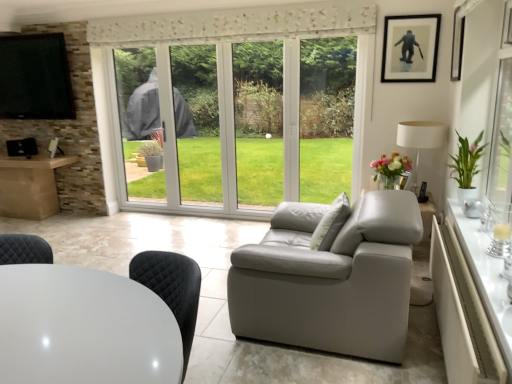
Question: Is black glossy picture frame at upper right, which appears as the 1th picture frame when viewed from the front, taller than white textured pillow at center?

Choices:
 (A) no
 (B) yes

Answer: (A)

Question: Considering the relative sizes of black glossy picture frame at upper right, the 2th picture frame from the back, and white textured pillow at center in the image provided, is black glossy picture frame at upper right, the 2th picture frame from the back, shorter than white textured pillow at center?

Choices:
 (A) no
 (B) yes

Answer: (B)

Question: Is black glossy picture frame at upper right, the 2th picture frame from the back, in front of white textured pillow at center?

Choices:
 (A) no
 (B) yes

Answer: (A)

Question: Would you say black glossy picture frame at upper right, the 2th picture frame from the back, is outside white textured pillow at center?

Choices:
 (A) yes
 (B) no

Answer: (A)

Question: Is white textured pillow at center at the back of black glossy picture frame at upper right, which appears as the 1th picture frame when viewed from the front?

Choices:
 (A) no
 (B) yes

Answer: (A)

Question: Is black glossy picture frame at upper right, the 2th picture frame from the back, in contact with white textured pillow at center?

Choices:
 (A) no
 (B) yes

Answer: (A)

Question: Is black glossy tv at upper left taller than white textured pillow at center?

Choices:
 (A) yes
 (B) no

Answer: (A)

Question: Can you confirm if black glossy tv at upper left is wider than white textured pillow at center?

Choices:
 (A) yes
 (B) no

Answer: (B)

Question: Is black glossy tv at upper left thinner than white textured pillow at center?

Choices:
 (A) yes
 (B) no

Answer: (A)

Question: Is black glossy tv at upper left touching white textured pillow at center?

Choices:
 (A) yes
 (B) no

Answer: (B)

Question: Is black glossy tv at upper left oriented away from white textured pillow at center?

Choices:
 (A) no
 (B) yes

Answer: (A)

Question: Is black glossy tv at upper left far from white textured pillow at center?

Choices:
 (A) no
 (B) yes

Answer: (B)

Question: Is white glossy table at right, the first table from the right, smaller than black matte picture frame at upper right, positioned as the 1th picture frame in back-to-front order?

Choices:
 (A) yes
 (B) no

Answer: (B)